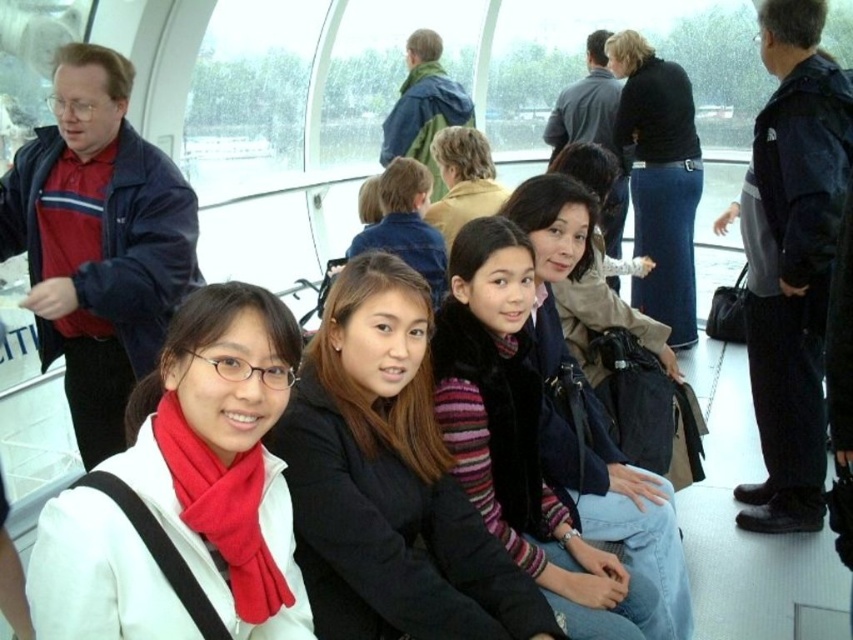
Which is above, black leather jacket at center or light brown hair at center?

black leather jacket at center

Is black leather jacket at center closer to the viewer compared to light brown hair at center?

No, it is not.

At what (x,y) coordinates should I click in order to perform the action: click on black leather jacket at center. Please return your answer as a coordinate pair (x, y). Looking at the image, I should click on (659, 177).

Is white matte scarf at lower left behind light brown hair at center?

No, white matte scarf at lower left is in front of light brown hair at center.

Between white matte scarf at lower left and light brown hair at center, which one is positioned lower?

white matte scarf at lower left is below.

At what (x,y) coordinates should I click in order to perform the action: click on white matte scarf at lower left. Please return your answer as a coordinate pair (x, y). Looking at the image, I should click on (223, 456).

Does white matte scarf at lower left have a smaller size compared to striped knit sweater at center?

Yes, white matte scarf at lower left is smaller than striped knit sweater at center.

Between white matte scarf at lower left and striped knit sweater at center, which one is positioned higher?

striped knit sweater at center is higher up.

What do you see at coordinates (223, 456) in the screenshot?
I see `white matte scarf at lower left` at bounding box center [223, 456].

This screenshot has width=853, height=640. What are the coordinates of `white matte scarf at lower left` in the screenshot? It's located at (223, 456).